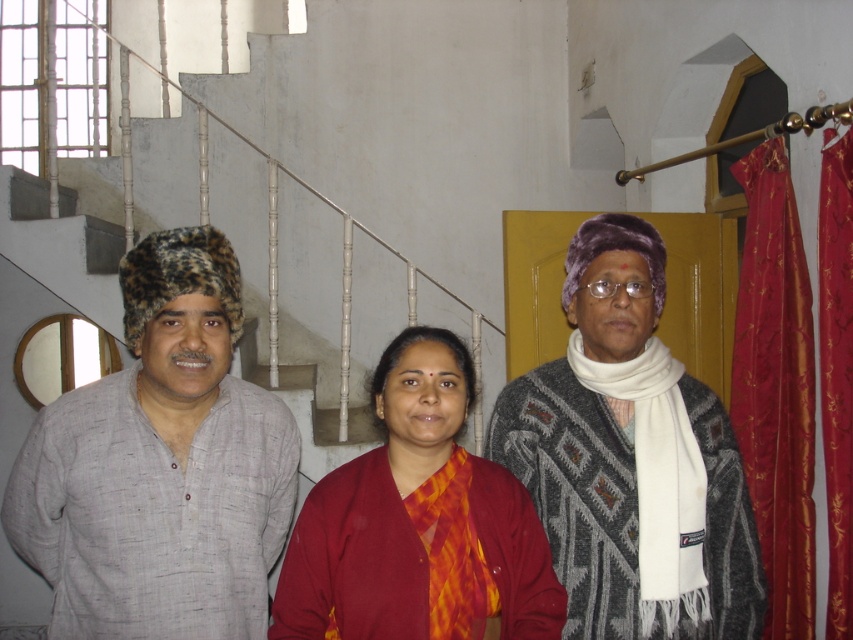
You are standing in front of the staircase and want to hand a gift to the woman in the red sari with orange and yellow patterns. Which object, the knitted woolen sweater at center or the red satin curtain at right, is closer to you so you can reach her more easily?

The knitted woolen sweater at center is closer to the viewer, so you can reach the woman in the red sari with orange and yellow patterns more easily by going towards the knitted woolen sweater at center.

You are standing at the bottom of the staircase in this residential interior. You need to go up the stairs but want to avoid the area near the light gray cotton kurta at left. Can you walk up the white textured stairs at upper left without stepping near the kurta?

The light gray cotton kurta at left is below the white textured stairs at upper left, so the stairs are above the kurta. You can walk up the white textured stairs at upper left without stepping near the kurta since the stairs are positioned above it.